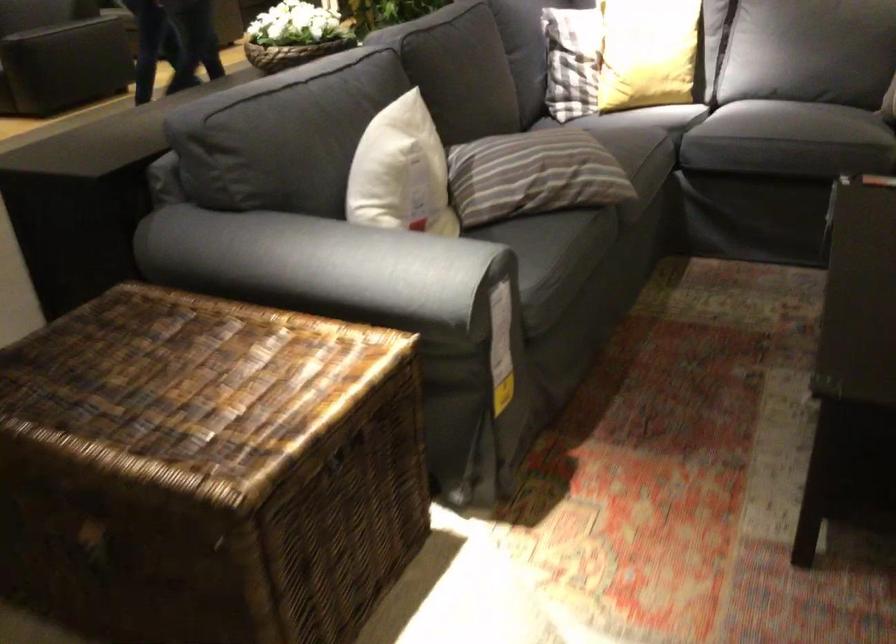
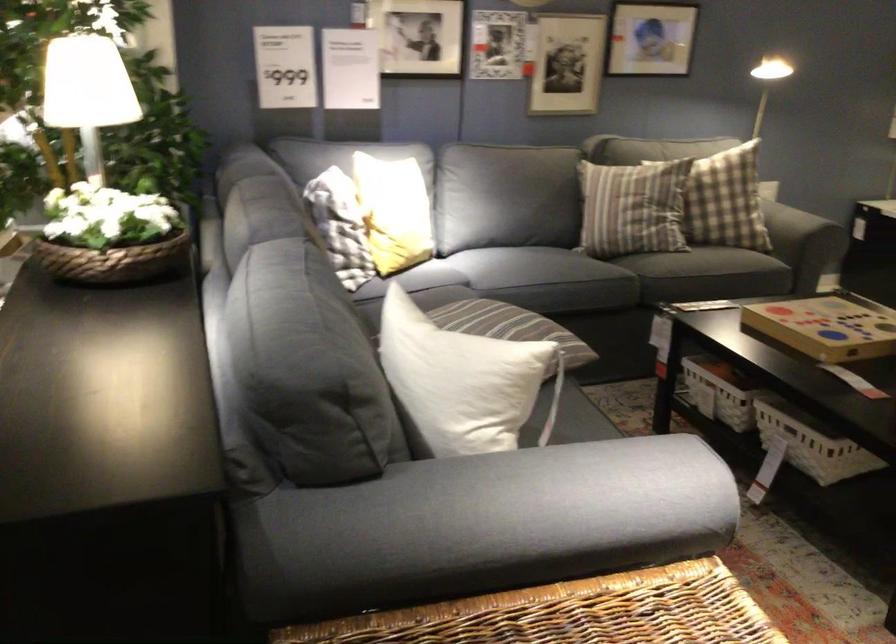
The point at (728, 109) is marked in the first image. Where is the corresponding point in the second image?

(538, 267)